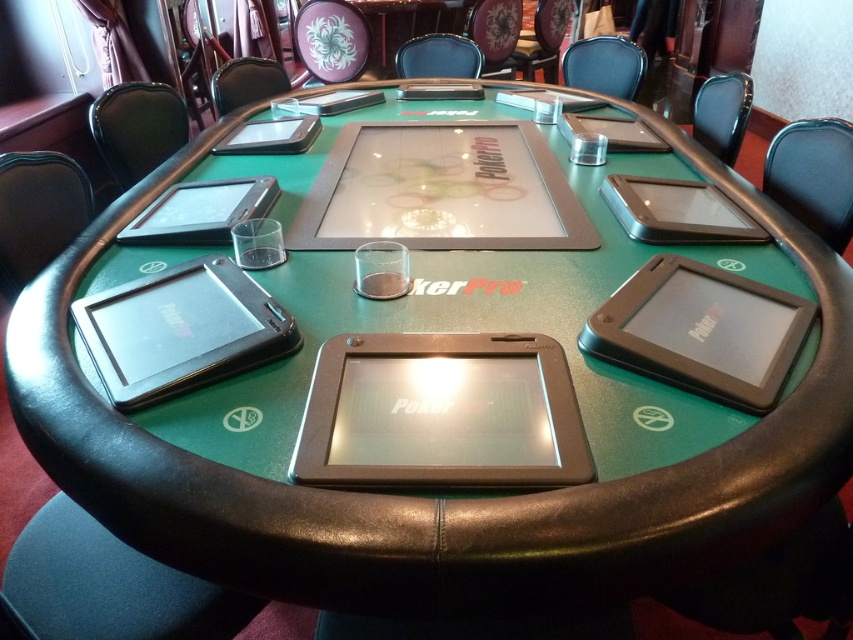
Consider the image. Which of these two, satin black tablet at center or matte black tablet at upper center, stands taller?

Standing taller between the two is matte black tablet at upper center.

Is satin black tablet at center below matte black tablet at upper center?

Yes.

Does point (554, 390) lie behind point (250, 140)?

No, it is not.

Find the location of `satin black tablet at center`. satin black tablet at center is located at coordinates (440, 413).

This screenshot has height=640, width=853. What do you see at coordinates (677, 211) in the screenshot? I see `silver metallic tablet at upper right` at bounding box center [677, 211].

Is point (755, 241) closer to viewer compared to point (634, 125)?

Yes, point (755, 241) is in front of point (634, 125).

The width and height of the screenshot is (853, 640). In order to click on silver metallic tablet at upper right in this screenshot , I will do coord(677,211).

Does black plastic ipad at lower right have a lesser width compared to matte black tablet at upper right?

Incorrect, black plastic ipad at lower right's width is not less than matte black tablet at upper right's.

Does point (747, 369) come closer to viewer compared to point (659, 141)?

Yes.

Describe the element at coordinates (701, 332) in the screenshot. Image resolution: width=853 pixels, height=640 pixels. I see `black plastic ipad at lower right` at that location.

Find the location of a particular element. This screenshot has height=640, width=853. black plastic ipad at lower right is located at coordinates (701, 332).